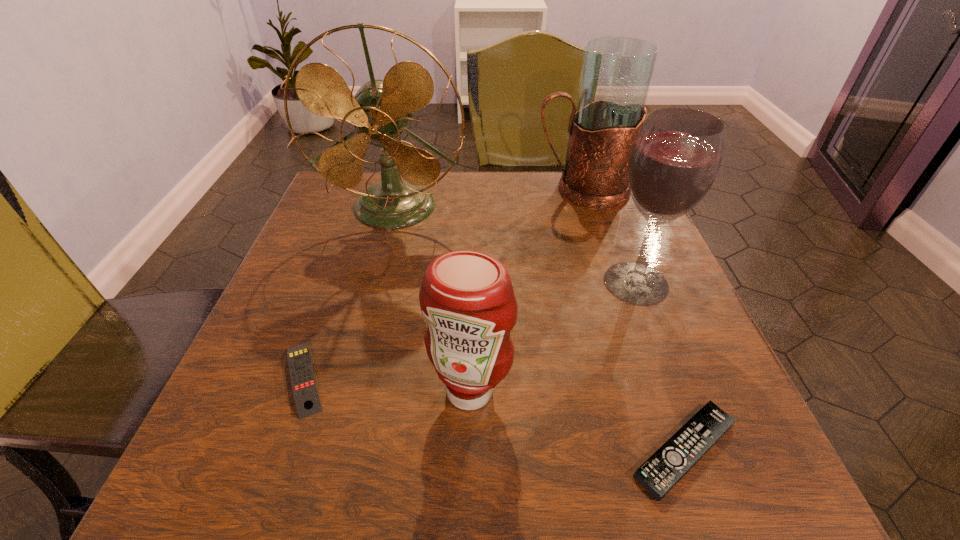
Locate an element on the screen. The image size is (960, 540). free space that is in between the pitcher and the fan is located at coordinates (488, 199).

The height and width of the screenshot is (540, 960). Find the location of `object that ranks as the fifth closest to the fourth tallest object`. object that ranks as the fifth closest to the fourth tallest object is located at coordinates (616, 74).

In order to click on the fourth closest object to the pitcher in this screenshot , I will do `click(661, 472)`.

Locate an element on the screen. Image resolution: width=960 pixels, height=540 pixels. blank area in the image that satisfies the following two spatial constraints: 1. with the handle on the side of the shorter remote control; 2. on the right side of the pitcher is located at coordinates (666, 450).

Locate an element on the screen. The height and width of the screenshot is (540, 960). free location that satisfies the following two spatial constraints: 1. with the handle on the side of the pitcher; 2. in front of the fan, directing air flow is located at coordinates (588, 208).

The width and height of the screenshot is (960, 540). What are the coordinates of `vacant space that satisfies the following two spatial constraints: 1. on the front side of the shortest object; 2. on the right side of the condiment` in the screenshot? It's located at coord(468,450).

Where is `free space that satisfies the following two spatial constraints: 1. with the handle on the side of the pitcher; 2. on the right side of the alcohol`? The image size is (960, 540). free space that satisfies the following two spatial constraints: 1. with the handle on the side of the pitcher; 2. on the right side of the alcohol is located at coordinates (612, 283).

Locate an element on the screen. free location that satisfies the following two spatial constraints: 1. with the handle on the side of the pitcher; 2. on the front side of the third shortest object is located at coordinates (647, 391).